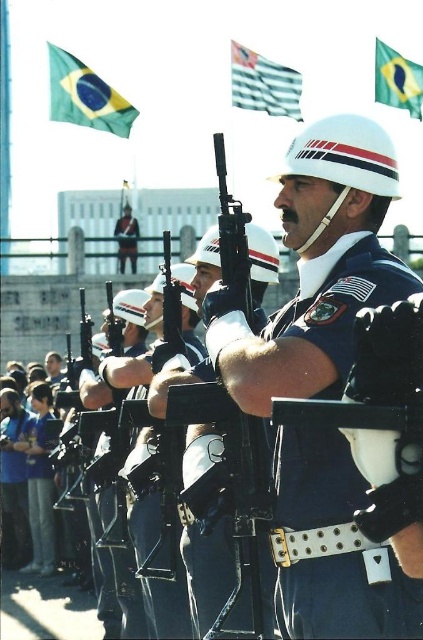
You are a photographer at the military event and want to capture a photo that includes both the green fabric flag at upper left and the white matte helmet at upper center. Based on their positions, which object should you place on the left side of your camera frame to ensure both are in the shot?

You should place the green fabric flag at upper left on the left side of your camera frame since it is already positioned to the left of the white matte helmet at upper center in the scene.

You are a photographer positioned in front of the scene. You need to capture a photo that includes both the green fabric flag at upper left and the blue fabric shirt at lower left. Which object should be placed on the left side of the photo to ensure both are visible?

The green fabric flag at upper left should be placed on the left side of the photo since it is already positioned to the left of the blue fabric shirt at lower left, ensuring both are visible in the frame.

You are a photographer at the event and want to capture a photo that includes both the green fabric flag at upper left and the white matte helmet at upper center. Based on their positions, which object should appear higher in the photo?

The green fabric flag at upper left should appear higher in the photo because it is located above the white matte helmet at upper center.